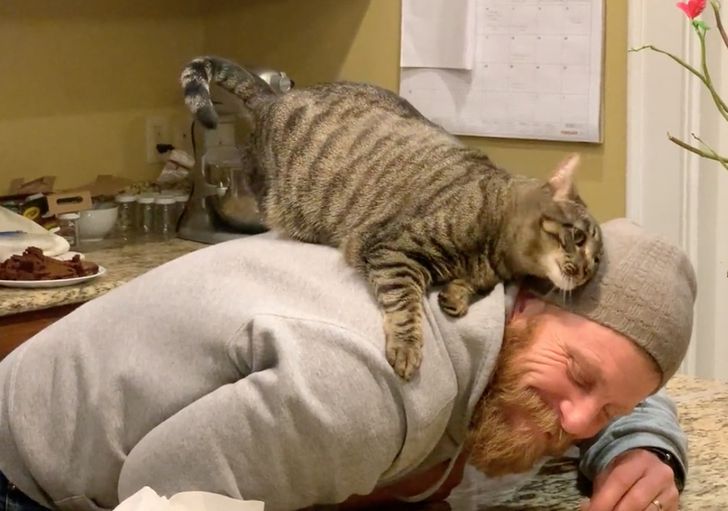
Identify the location of spice jars. (130, 217), (146, 217), (167, 217).